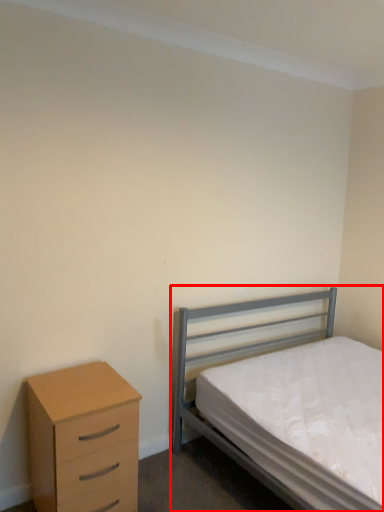
Question: From the image's perspective, where is bed (annotated by the red box) located relative to chest of drawers?

Choices:
 (A) above
 (B) below

Answer: (A)